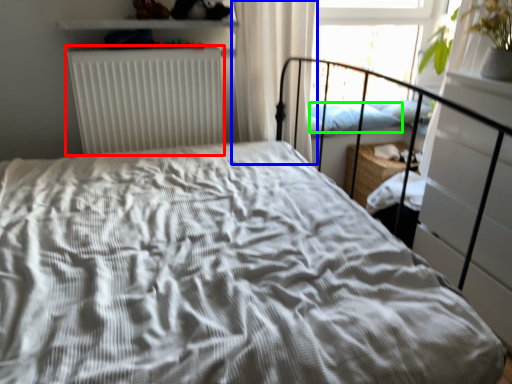
Question: Which object is positioned closest to radiator (highlighted by a red box)? Select from curtain (highlighted by a blue box) and pillow (highlighted by a green box).

Choices:
 (A) curtain
 (B) pillow

Answer: (A)